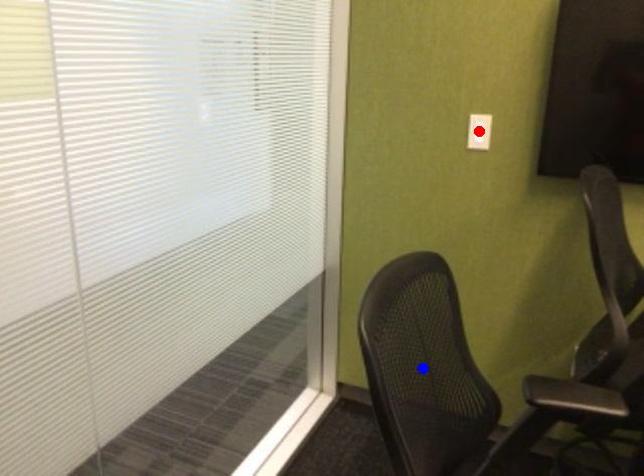
Question: Two points are marked on the image. Which point is closer to the camera?

Choices:
 (A) Blue point is closer.
 (B) Red point is closer.

Answer: (A)